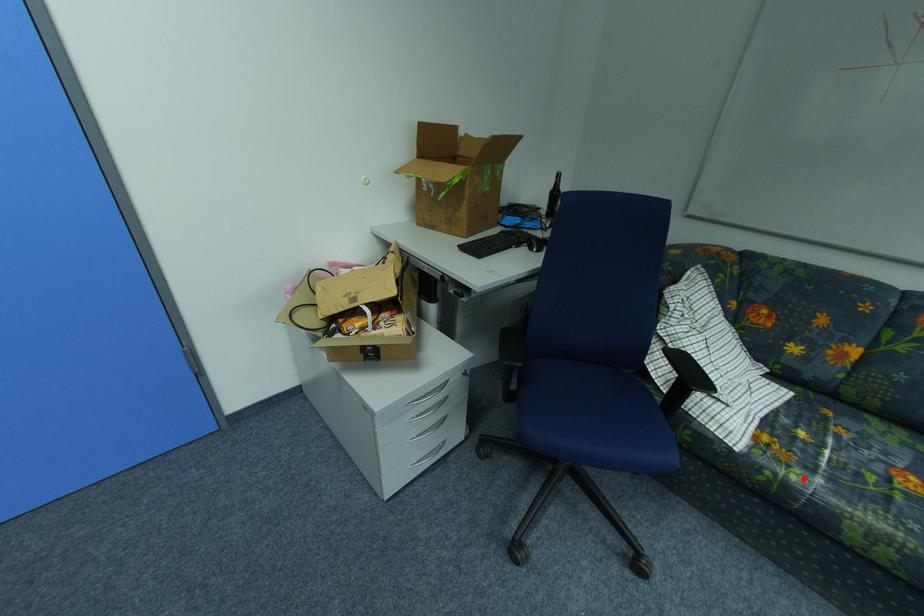
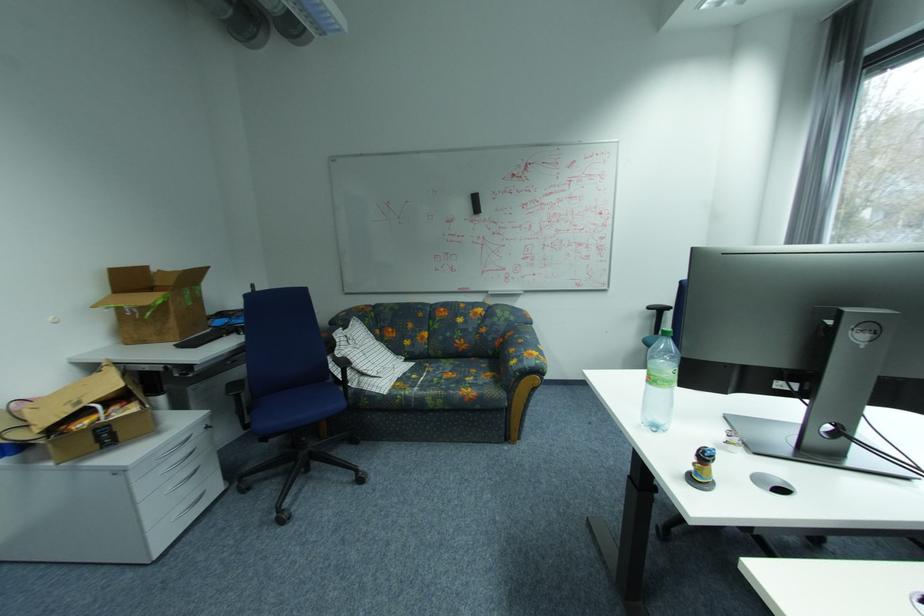
The point at the highlighted location is marked in the first image. Where is the corresponding point in the second image?

(416, 392)